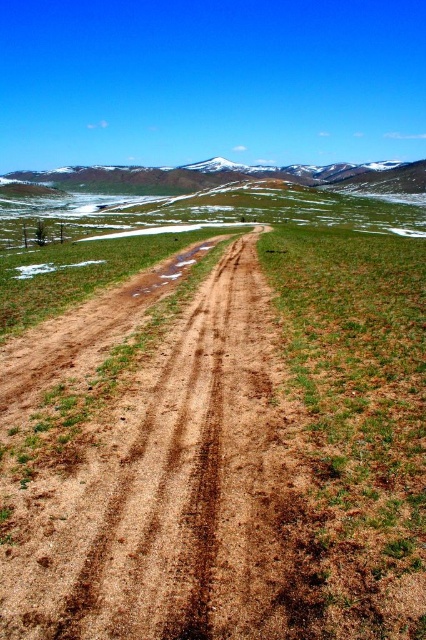
From the picture: You are driving a car and see the brown dirt road at center and the snowy rocky mountain at upper center. Which direction should you turn to follow the road towards the mountain?

To follow the road towards the mountain, you should turn to the right since the brown dirt road at center is positioned on the right side of the snowy rocky mountain at upper center.